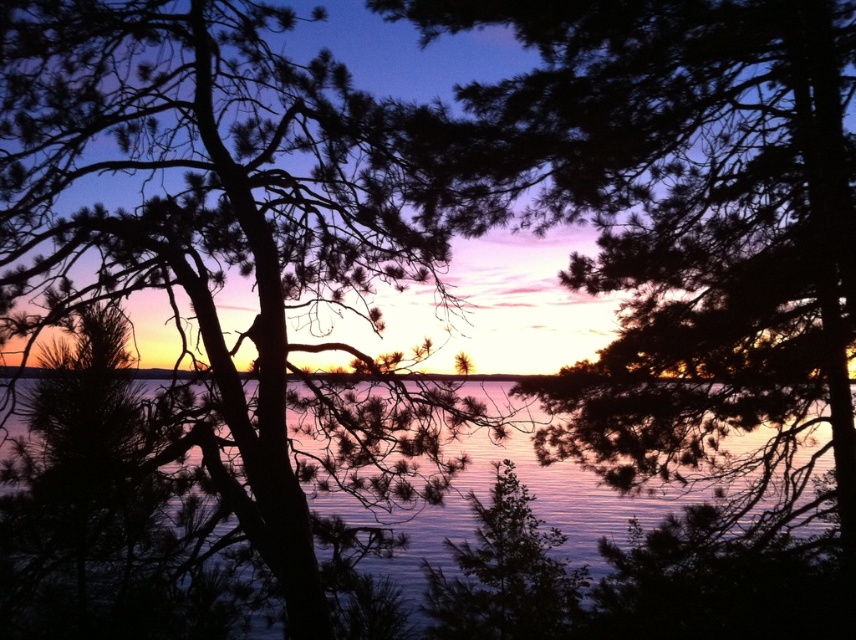
Question: Does silky dark green branches at center appear on the right side of blue reflective water at center?

Choices:
 (A) no
 (B) yes

Answer: (B)

Question: Which is farther from the silhouette tree at center?

Choices:
 (A) silky dark green branches at center
 (B) blue reflective water at center

Answer: (A)

Question: Which point is farther to the camera?

Choices:
 (A) (833, 609)
 (B) (337, 301)

Answer: (B)

Question: Which of the following is the farthest from the observer?

Choices:
 (A) (712, 593)
 (B) (800, 38)

Answer: (A)

Question: Does silhouette tree at center have a greater width compared to silky dark green branches at center?

Choices:
 (A) yes
 (B) no

Answer: (B)

Question: From the image, what is the correct spatial relationship of silhouette tree at center in relation to blue reflective water at center?

Choices:
 (A) below
 (B) above

Answer: (B)